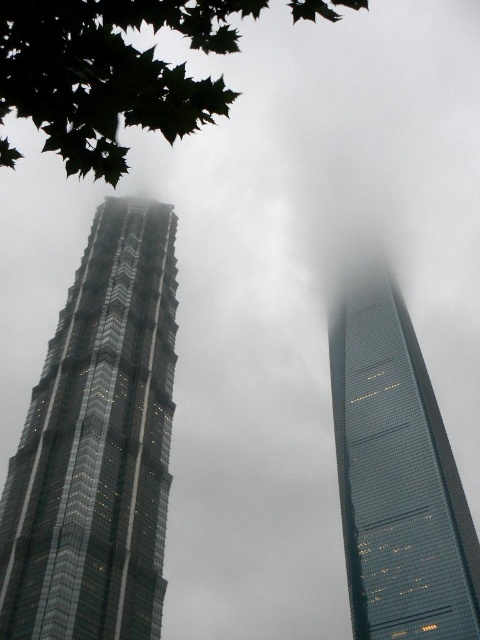
Is glassy metallic skyscraper at left closer to the viewer compared to green leafy tree at upper left?

No, glassy metallic skyscraper at left is behind green leafy tree at upper left.

Does glassy metallic skyscraper at left appear over green leafy tree at upper left?

Actually, glassy metallic skyscraper at left is below green leafy tree at upper left.

Does point (48, 369) come closer to viewer compared to point (233, 13)?

Yes, point (48, 369) is closer to viewer.

Where is `glassy metallic skyscraper at left`? This screenshot has width=480, height=640. glassy metallic skyscraper at left is located at coordinates (97, 444).

Identify the location of glassy teal skyscraper at center. (396, 480).

Does glassy teal skyscraper at center have a lesser width compared to green leafy tree at upper left?

Correct, glassy teal skyscraper at center's width is less than green leafy tree at upper left's.

Who is more forward, (421, 525) or (60, 81)?

Positioned in front is point (60, 81).

Find the location of a particular element. The height and width of the screenshot is (640, 480). glassy teal skyscraper at center is located at coordinates (396, 480).

Is glassy metallic skyscraper at left taller than glassy teal skyscraper at center?

No.

Between point (132, 241) and point (403, 541), which one is positioned in front?

Point (132, 241) is in front.

Locate an element on the screen. The image size is (480, 640). glassy metallic skyscraper at left is located at coordinates (97, 444).